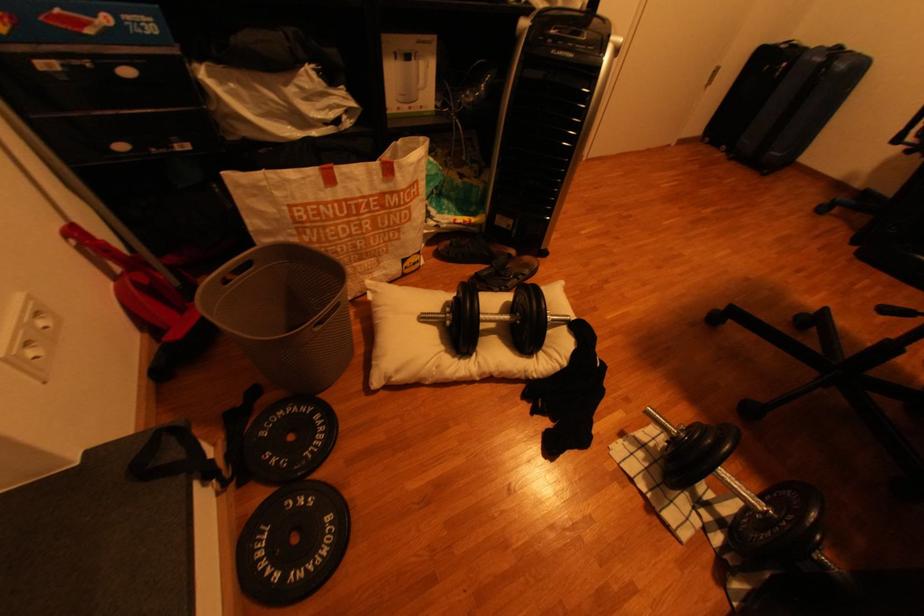
Identify the location of black exercise handle. The height and width of the screenshot is (616, 924). (747, 496).